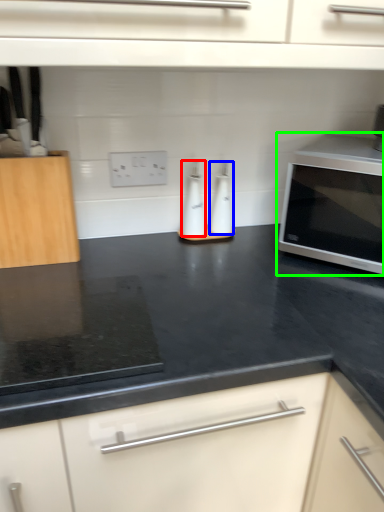
Question: Considering the real-world distances, which object is farthest from bottle (highlighted by a red box)? bottle (highlighted by a blue box) or microwave oven (highlighted by a green box)?

Choices:
 (A) bottle
 (B) microwave oven

Answer: (B)